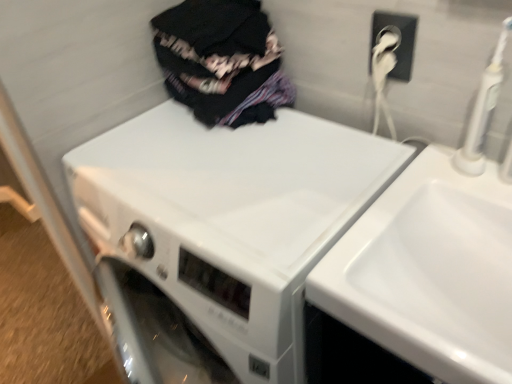
Question: Is point (436, 337) positioned closer to the camera than point (395, 160)?

Choices:
 (A) closer
 (B) farther

Answer: (A)

Question: From a real-world perspective, is white glossy sink at upper right positioned above or below white glossy washing machine at center?

Choices:
 (A) below
 (B) above

Answer: (B)

Question: Based on their relative distances, which object is nearer to the white glossy washing machine at center?

Choices:
 (A) white glossy sink at upper right
 (B) dark fabric clothes at upper center
 (C) white plastic electric outlet at upper right

Answer: (A)

Question: Considering the real-world distances, which object is farthest from the white glossy sink at upper right?

Choices:
 (A) white plastic electric outlet at upper right
 (B) dark fabric clothes at upper center
 (C) white glossy washing machine at center

Answer: (B)